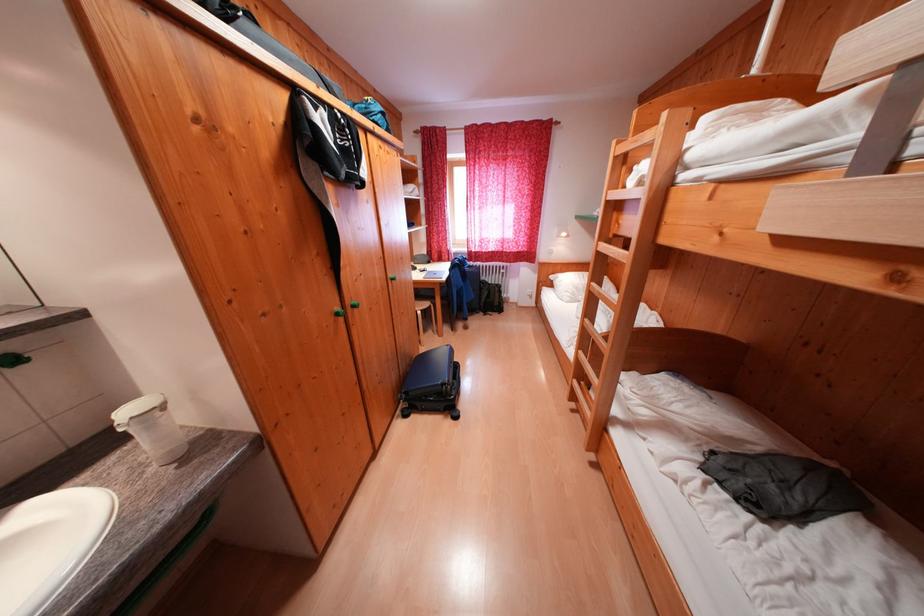
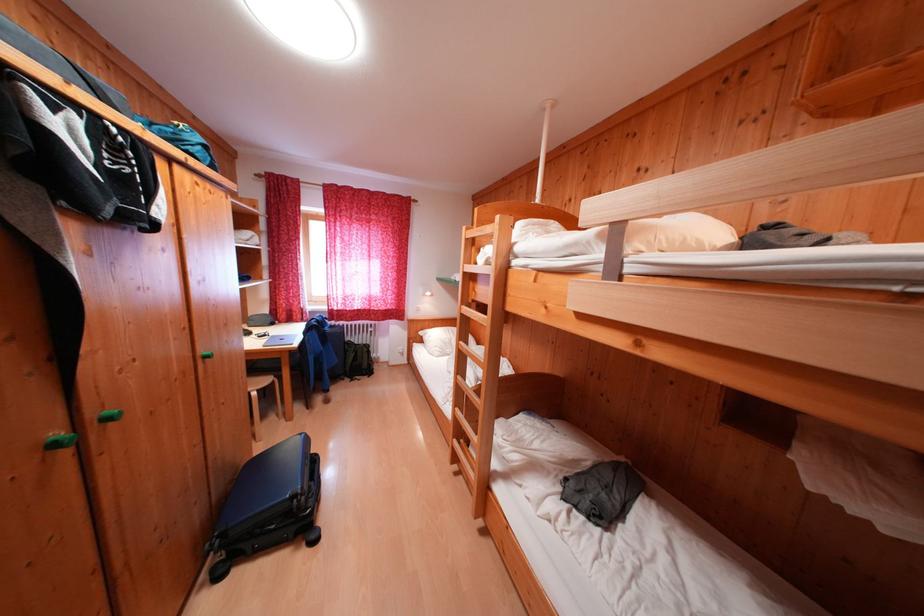
Question: How did the camera likely rotate?

Choices:
 (A) Left
 (B) Right
 (C) Up
 (D) Down

Answer: (B)